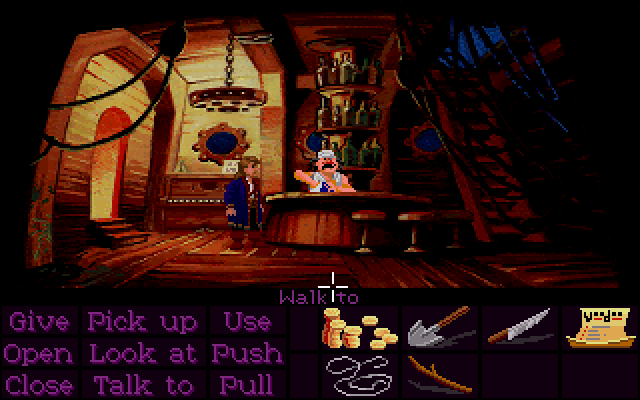
Where is `stairs`? stairs is located at coordinates (491, 176).